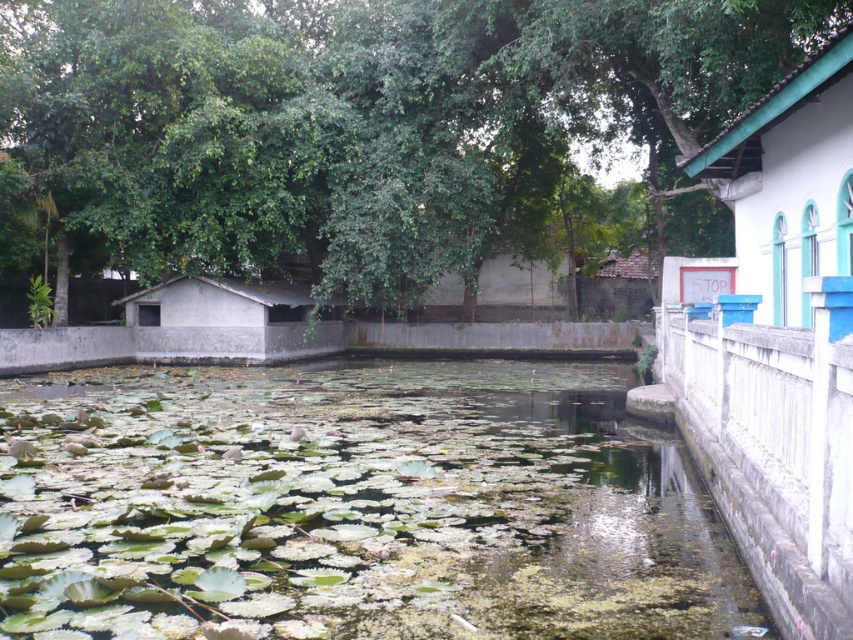
Question: From the image, what is the correct spatial relationship of green algae-covered water at center in relation to gray concrete hut at center?

Choices:
 (A) below
 (B) above

Answer: (A)

Question: Which point appears farthest from the camera in this image?

Choices:
 (A) (216, 465)
 (B) (164, 285)
 (C) (646, 289)

Answer: (C)

Question: Which object is positioned farthest from the green algae-covered water at center?

Choices:
 (A) brown clay hut at center
 (B) gray concrete hut at center
 (C) green leafy tree at upper center

Answer: (A)

Question: Which of the following is the closest to the observer?

Choices:
 (A) (155, 266)
 (B) (378, 538)
 (C) (596, 282)
 (D) (740, 198)

Answer: (B)

Question: Is green algae-covered water at center further to camera compared to white painted wood hut at upper right?

Choices:
 (A) no
 (B) yes

Answer: (A)

Question: Can you confirm if green leafy tree at upper center is positioned above green algae-covered water at center?

Choices:
 (A) yes
 (B) no

Answer: (A)